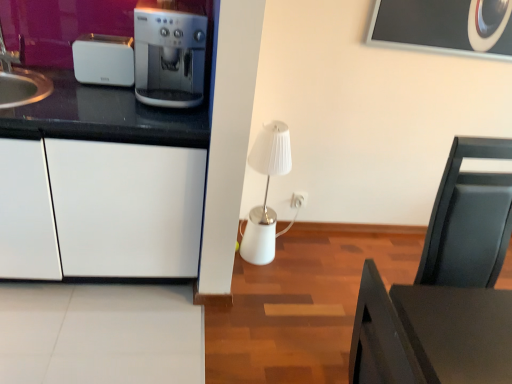
Question: From their relative heights in the image, would you say black matte table at lower right is taller or shorter than white plastic toaster at left?

Choices:
 (A) short
 (B) tall

Answer: (B)

Question: Is black matte table at lower right situated inside white plastic toaster at left or outside?

Choices:
 (A) inside
 (B) outside

Answer: (B)

Question: Which object is the closest to the black matte table at lower right?

Choices:
 (A) white plastic toaster at left
 (B) white glossy cabinet at left
 (C) white plastic electric outlet at center-right
 (D) satin silver coffee machine at left

Answer: (B)

Question: Based on their relative distances, which object is farther from the white plastic toaster at left?

Choices:
 (A) white glossy cabinet at left
 (B) black matte table at lower right
 (C) white plastic electric outlet at center-right
 (D) satin silver coffee machine at left

Answer: (B)